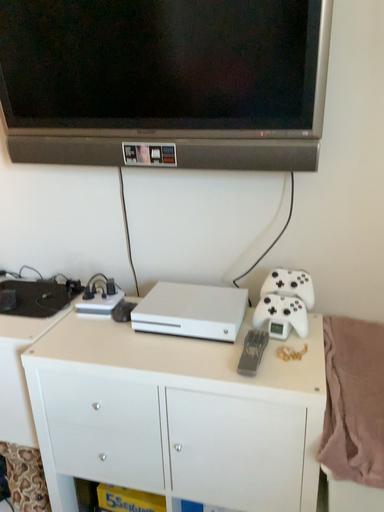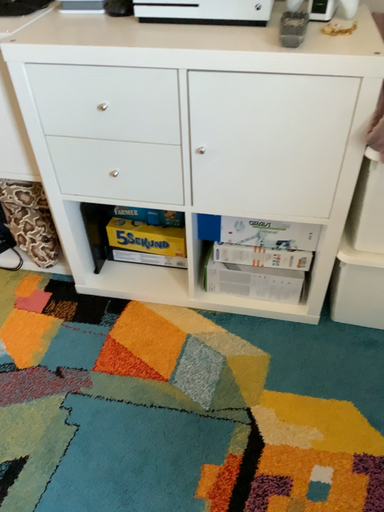
Question: How did the camera likely rotate when shooting the video?

Choices:
 (A) rotated downward
 (B) rotated upward

Answer: (A)